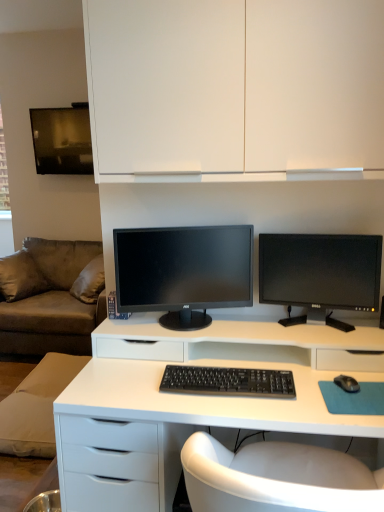
Question: Can you confirm if matte black monitor at center, arranged as the 1th computer monitor when viewed from the left, is shorter than black plastic keyboard at center?

Choices:
 (A) no
 (B) yes

Answer: (A)

Question: Does matte black monitor at center, arranged as the 1th computer monitor when viewed from the left, come behind black plastic keyboard at center?

Choices:
 (A) yes
 (B) no

Answer: (A)

Question: Is matte black monitor at center, which appears as the second computer monitor when viewed from the right, located outside black plastic keyboard at center?

Choices:
 (A) no
 (B) yes

Answer: (B)

Question: Does matte black monitor at center, which appears as the second computer monitor when viewed from the right, have a larger size compared to black plastic keyboard at center?

Choices:
 (A) no
 (B) yes

Answer: (B)

Question: From a real-world perspective, is matte black monitor at center, which appears as the second computer monitor when viewed from the right, positioned under black plastic keyboard at center based on gravity?

Choices:
 (A) yes
 (B) no

Answer: (B)

Question: Looking at the image, does black glossy monitor at center right, which appears as the second computer monitor when viewed from the left, seem bigger or smaller compared to matte black monitor at center, which appears as the second computer monitor when viewed from the right?

Choices:
 (A) small
 (B) big

Answer: (A)

Question: Is black glossy monitor at center right, which appears as the second computer monitor when viewed from the left, situated inside matte black monitor at center, which appears as the second computer monitor when viewed from the right, or outside?

Choices:
 (A) outside
 (B) inside

Answer: (A)

Question: Is black glossy monitor at center right, which appears as the second computer monitor when viewed from the left, to the left or to the right of matte black monitor at center, arranged as the 1th computer monitor when viewed from the left, in the image?

Choices:
 (A) right
 (B) left

Answer: (A)

Question: Is black glossy monitor at center right, which appears as the second computer monitor when viewed from the left, taller or shorter than matte black monitor at center, arranged as the 1th computer monitor when viewed from the left?

Choices:
 (A) short
 (B) tall

Answer: (A)

Question: Would you say black glossy monitor at center right, which appears as the second computer monitor when viewed from the left, is to the left or to the right of black plastic keyboard at center in the picture?

Choices:
 (A) left
 (B) right

Answer: (B)

Question: From the image's perspective, is black glossy monitor at center right, which appears as the second computer monitor when viewed from the left, located above or below black plastic keyboard at center?

Choices:
 (A) above
 (B) below

Answer: (A)

Question: Is black glossy monitor at center right, which appears as the second computer monitor when viewed from the left, in front of or behind black plastic keyboard at center in the image?

Choices:
 (A) front
 (B) behind

Answer: (B)

Question: Is point (319, 282) positioned closer to the camera than point (173, 392)?

Choices:
 (A) closer
 (B) farther

Answer: (B)

Question: In the image, is black glossy monitor at center right, placed as the first computer monitor when sorted from right to left, positioned in front of or behind brown fabric couch at left?

Choices:
 (A) behind
 (B) front

Answer: (B)

Question: Is black glossy monitor at center right, which appears as the second computer monitor when viewed from the left, inside or outside of brown fabric couch at left?

Choices:
 (A) outside
 (B) inside

Answer: (A)